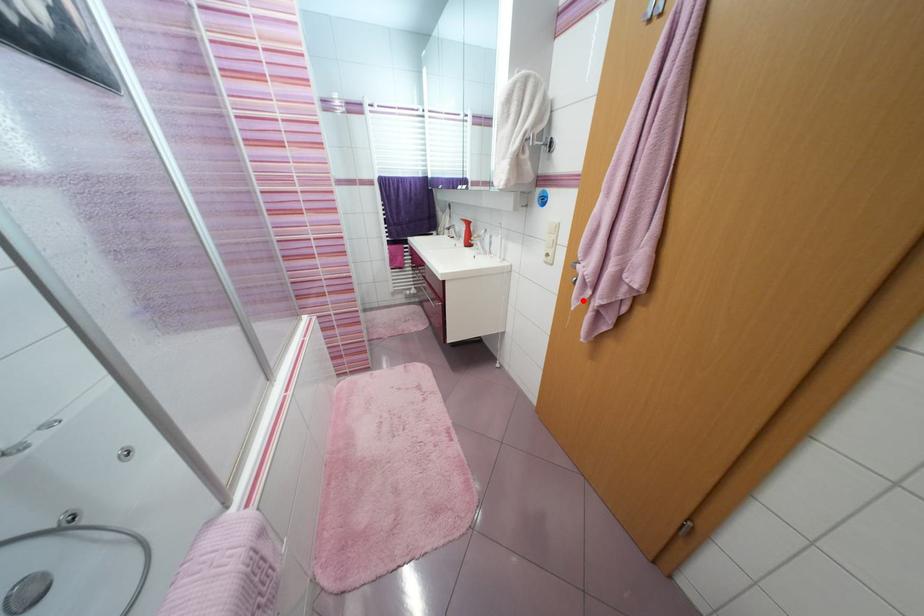
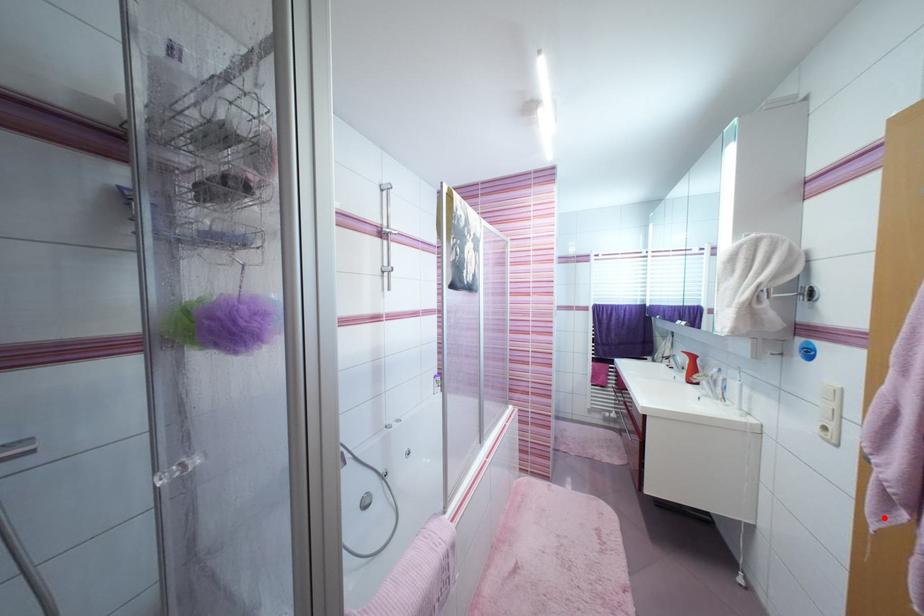
I am providing you with two images of the same scene from different viewpoints. A red point is marked on the first image and another point is marked on the second image. Does the point marked in image1 correspond to the same location as the one in image2?

Yes